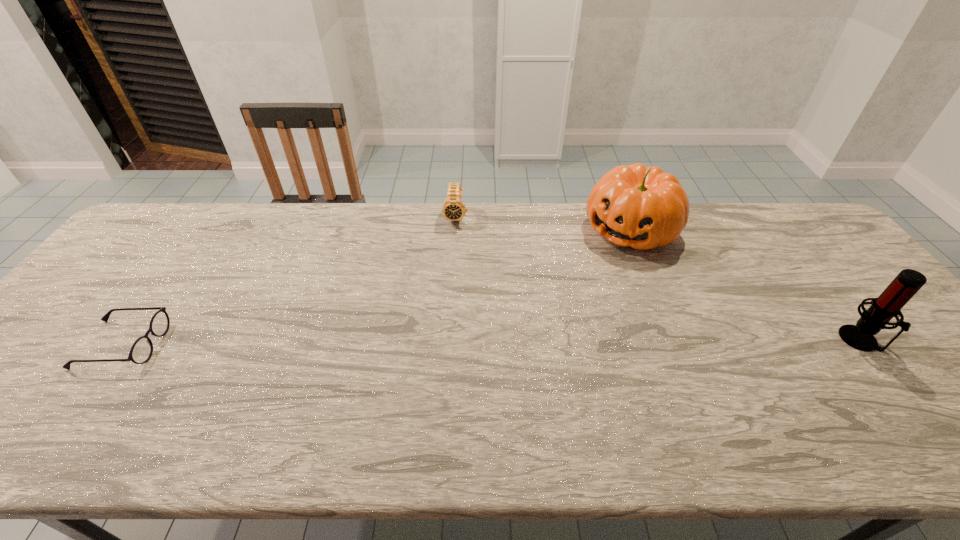
Locate an element on the screen. free point between the pumpkin and the watch is located at coordinates (543, 223).

Locate an element on the screen. The image size is (960, 540). vacant area that lies between the spectacles and the watch is located at coordinates (289, 281).

Find the location of a particular element. This screenshot has width=960, height=540. object that is the second closest one to the rightmost object is located at coordinates (453, 209).

Identify the location of object that can be found as the third closest to the second shortest object. (908, 282).

The width and height of the screenshot is (960, 540). In order to click on vacant space that satisfies the following two spatial constraints: 1. on the front side of the pumpkin; 2. on the right side of the microphone in this screenshot , I will do `click(675, 340)`.